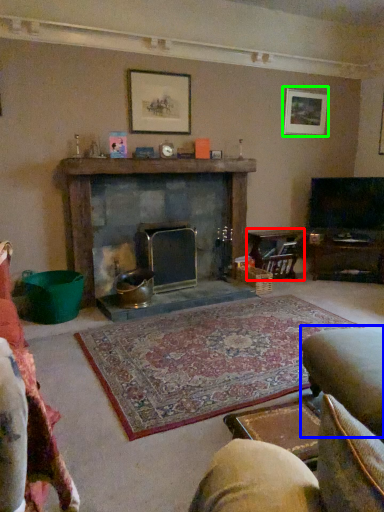
Question: Which object is positioned closest to table (highlighted by a red box)? Select from swivel chair (highlighted by a blue box) and picture frame (highlighted by a green box).

Choices:
 (A) swivel chair
 (B) picture frame

Answer: (B)